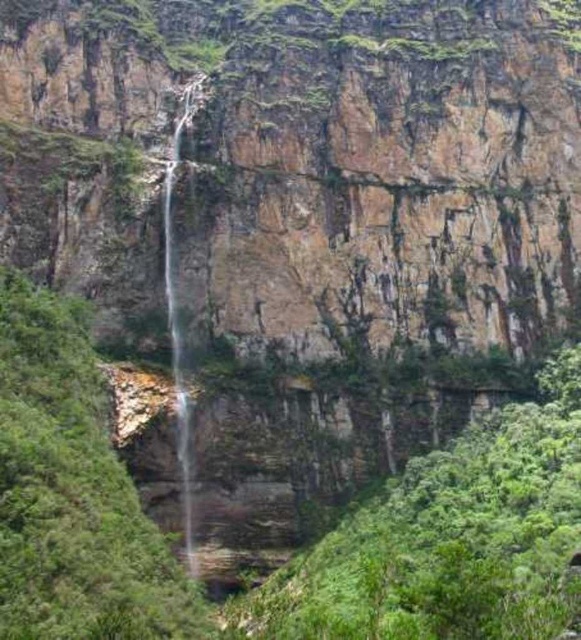
Between brown rocky cliff at center and clear water at center, which one is positioned lower?

clear water at center is lower down.

Does brown rocky cliff at center appear under clear water at center?

Incorrect, brown rocky cliff at center is not positioned below clear water at center.

Is point (69, 19) in front of point (188, 408)?

No, it is behind (188, 408).

At what (x,y) coordinates should I click in order to perform the action: click on brown rocky cliff at center. Please return your answer as a coordinate pair (x, y). Looking at the image, I should click on (335, 150).